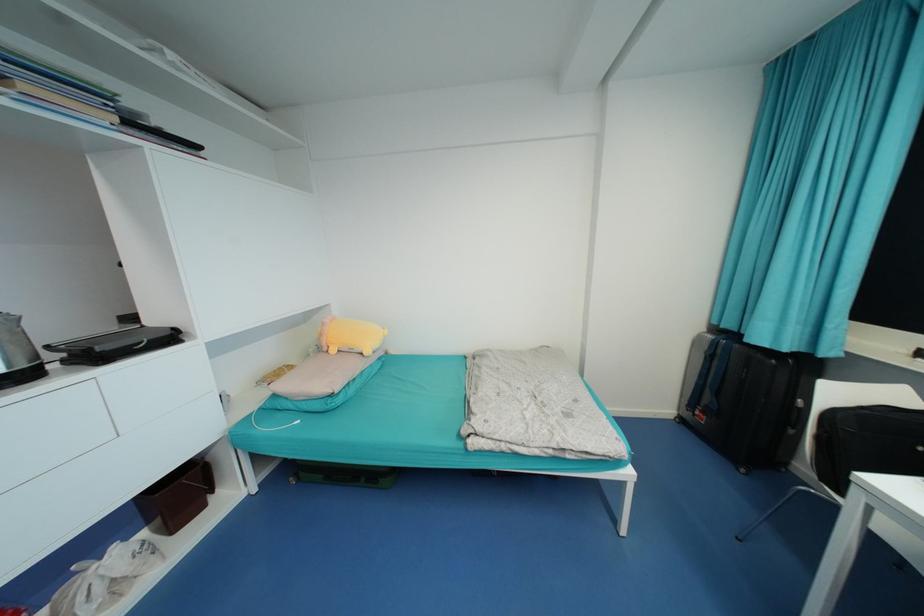
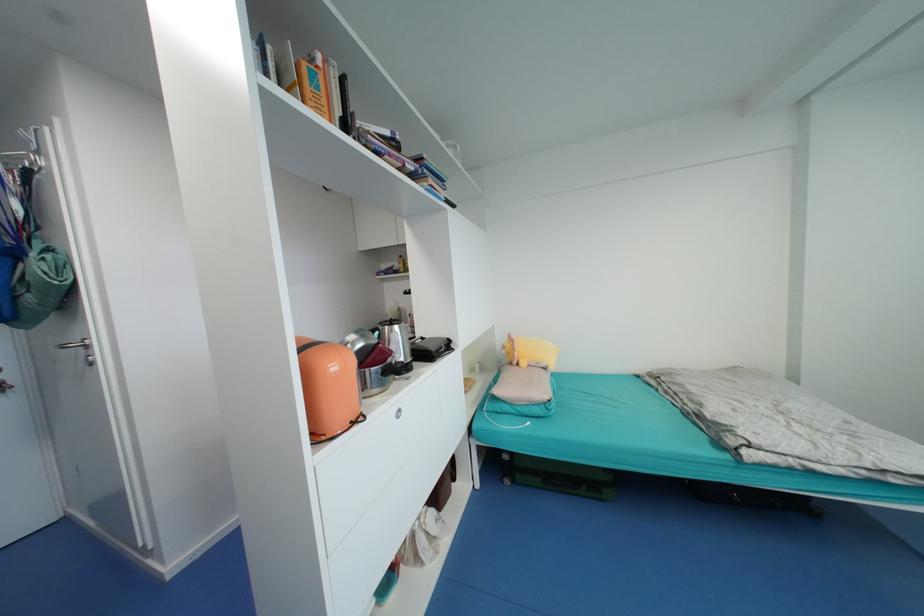
Find the pixel in the second image that matches point (337, 351) in the first image.

(529, 365)